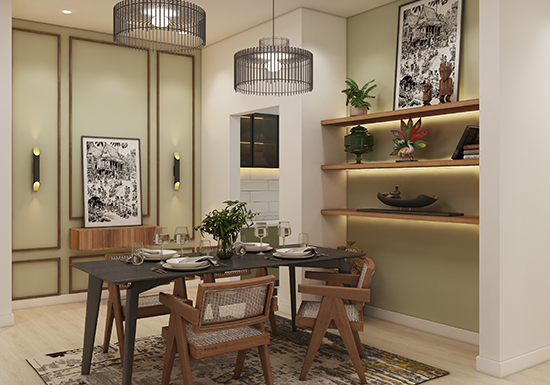
I want to click on wall leading into hallway, so 514,284.